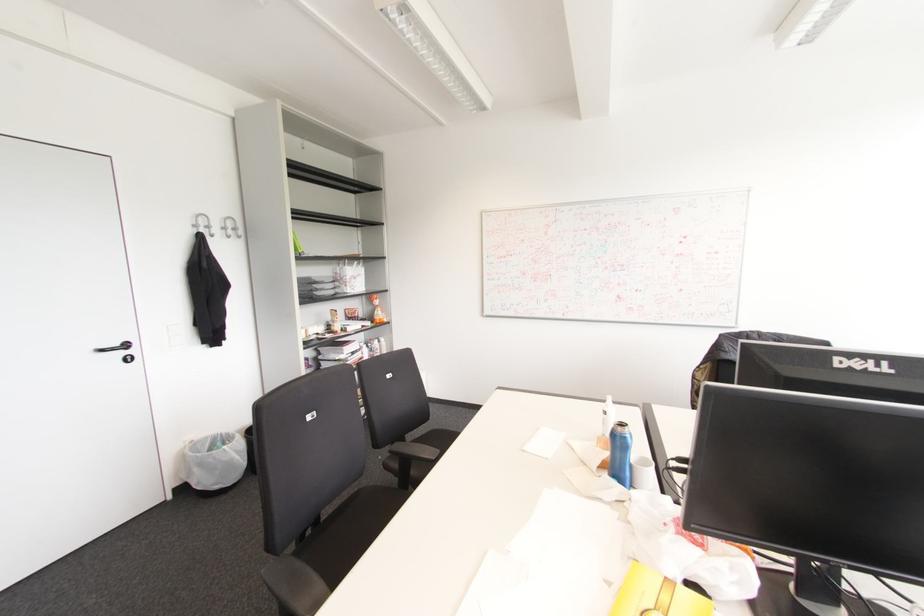
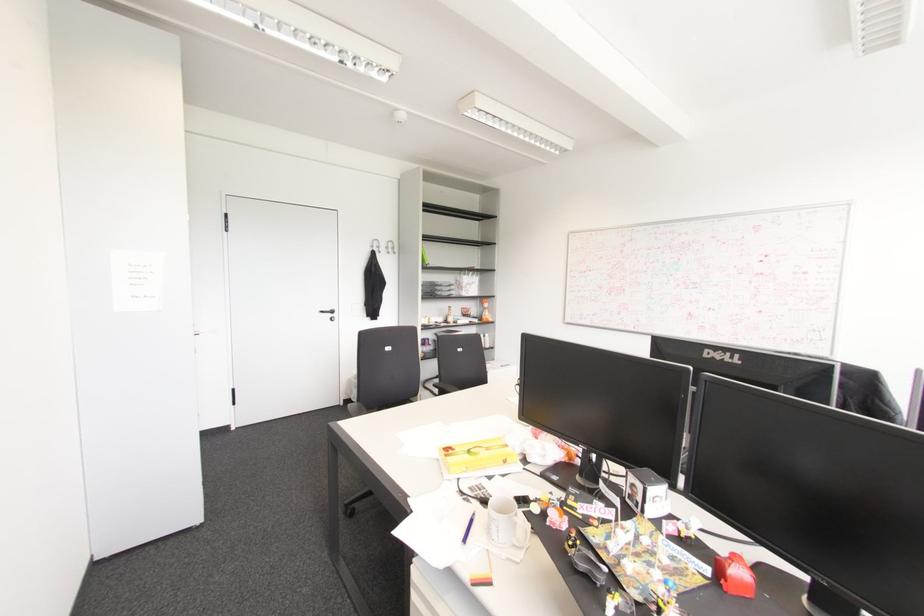
Where in the second image is the point corresponding to pixel 234 229 from the first image?

(392, 248)